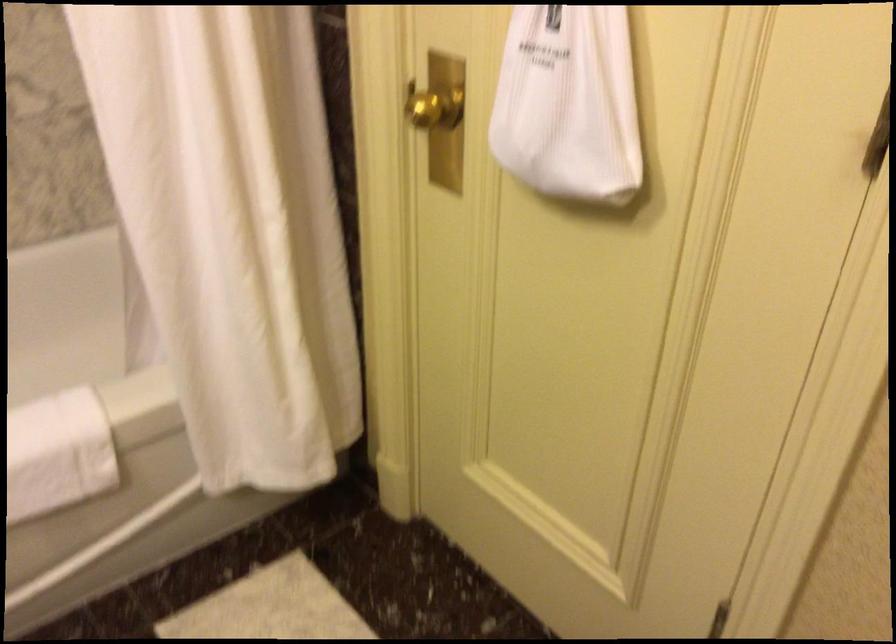
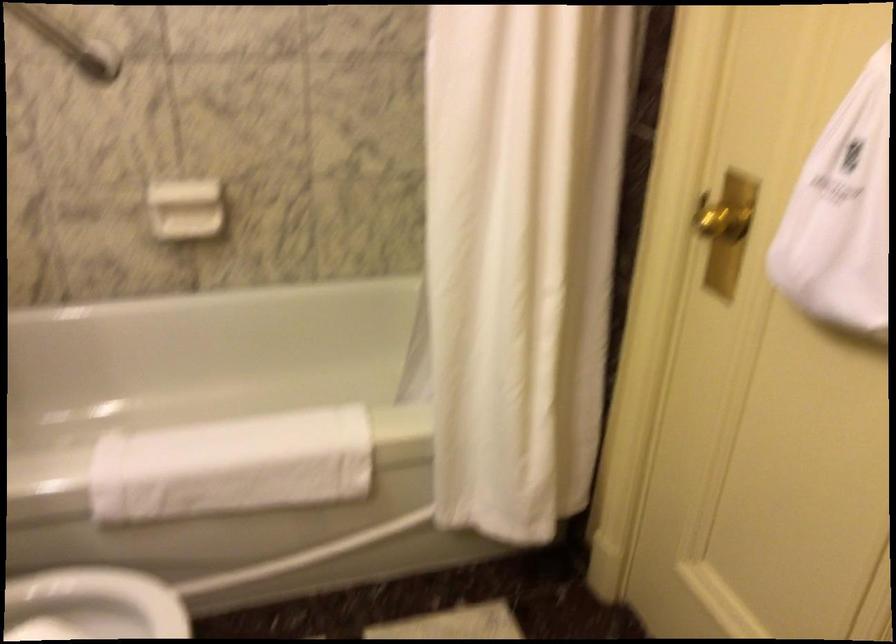
Locate, in the second image, the point that corresponds to (435,114) in the first image.

(722, 222)